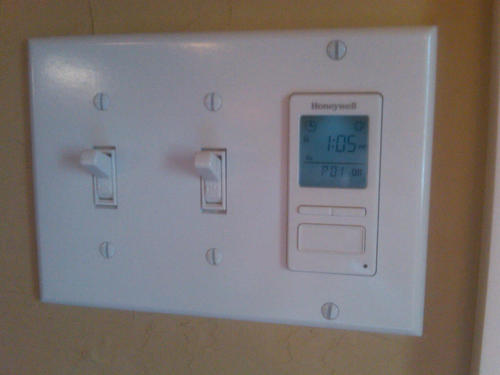
I want to click on wall, so click(469, 251), click(218, 174).